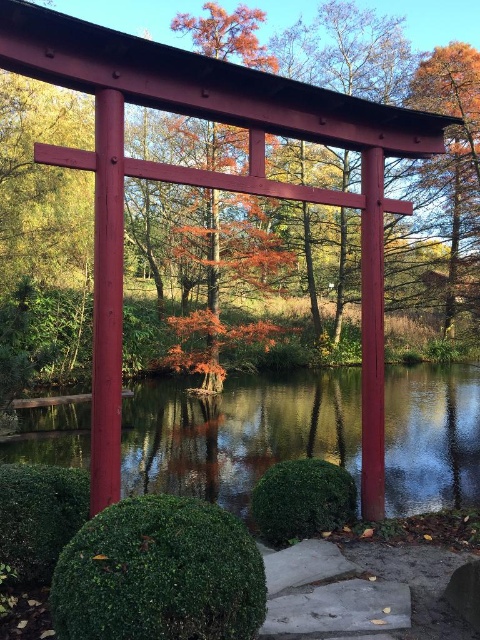
Question: Can you confirm if matte red wooden gate at center is positioned to the left of orange matte tree at upper right?

Choices:
 (A) no
 (B) yes

Answer: (B)

Question: Which object is closer to the camera taking this photo?

Choices:
 (A) matte red wooden gate at upper center
 (B) orange leafy tree at center
 (C) matte red wooden gate at center
 (D) transparent glass lake at center

Answer: (C)

Question: Which object appears closest to the camera in this image?

Choices:
 (A) orange leafy tree at center
 (B) matte red wooden gate at center
 (C) transparent glass lake at center
 (D) matte red wooden gate at upper center

Answer: (B)

Question: Among these points, which one is farthest from the camera?

Choices:
 (A) (300, 406)
 (B) (206, 29)
 (C) (323, 65)

Answer: (C)

Question: Does matte red wooden gate at upper center have a smaller size compared to orange matte tree at upper right?

Choices:
 (A) yes
 (B) no

Answer: (B)

Question: Is transparent glass lake at center smaller than orange leafy tree at center?

Choices:
 (A) no
 (B) yes

Answer: (B)